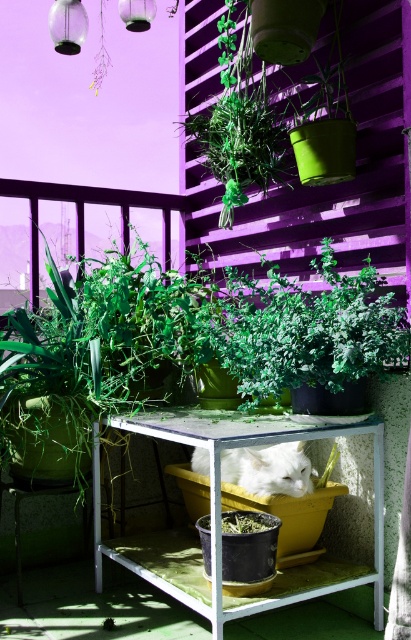
Between white metal table at center and white fluffy cat at center, which one appears on the right side from the viewer's perspective?

Positioned to the right is white fluffy cat at center.

Can you confirm if white metal table at center is positioned below white fluffy cat at center?

Yes.

This screenshot has height=640, width=411. Identify the location of white metal table at center. (219, 512).

Where is `white metal table at center`? The width and height of the screenshot is (411, 640). white metal table at center is located at coordinates (219, 512).